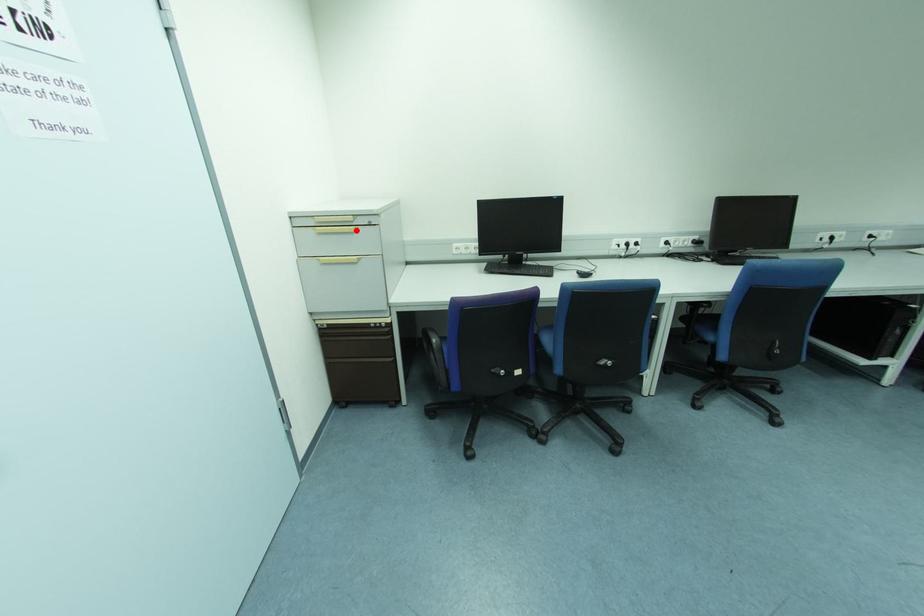
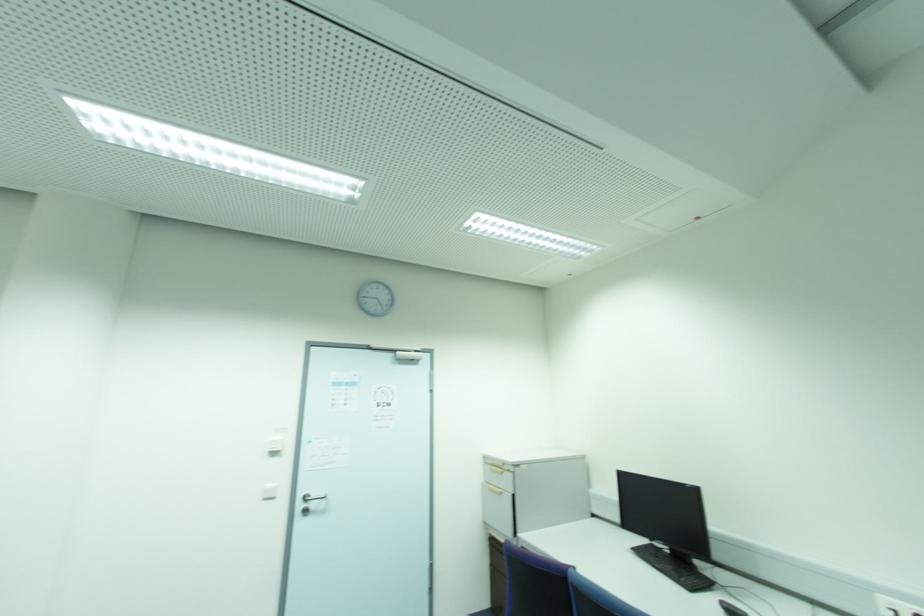
Question: I am providing you with two images of the same scene from different viewpoints. Image1 has a red point marked. In image2, the corresponding 3D location appears at what relative position? Reply with the corresponding letter.

Choices:
 (A) Closer
 (B) Farther

Answer: (B)